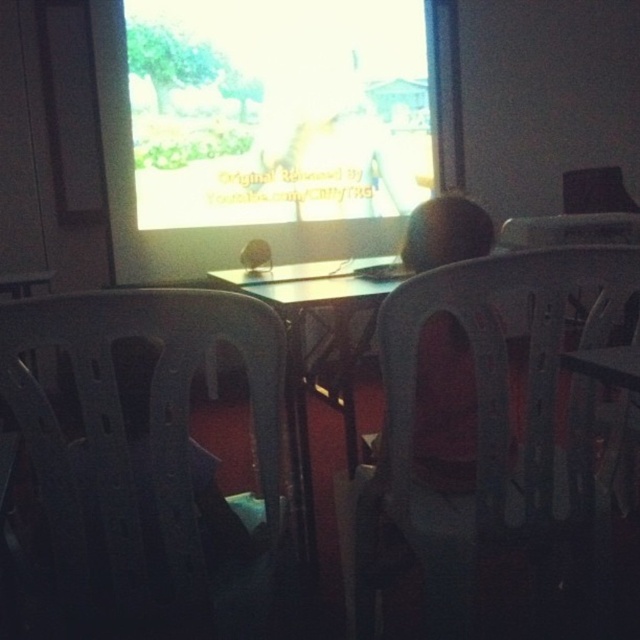
Can you confirm if bright yellow screen at upper center is wider than smooth plastic head at center?

Correct, the width of bright yellow screen at upper center exceeds that of smooth plastic head at center.

Does point (188, 54) come behind point (406, 269)?

Yes, point (188, 54) is behind point (406, 269).

Where is `bright yellow screen at upper center`? This screenshot has width=640, height=640. bright yellow screen at upper center is located at coordinates (276, 109).

Is bright yellow screen at upper center shorter than black plastic chair at left?

No.

Is bright yellow screen at upper center closer to the viewer compared to black plastic chair at left?

No.

Image resolution: width=640 pixels, height=640 pixels. Identify the location of bright yellow screen at upper center. (276, 109).

Which is in front, point (108, 337) or point (412, 528)?

Positioned in front is point (108, 337).

Does black plastic chair at left have a greater height compared to transparent plastic chair at center?

No.

The width and height of the screenshot is (640, 640). Identify the location of black plastic chair at left. (144, 458).